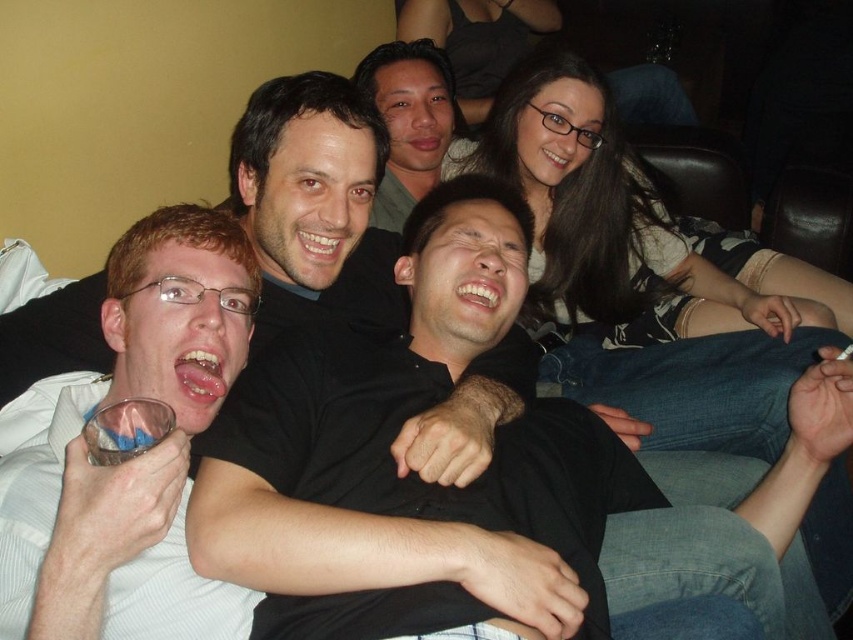
Can you confirm if black matte shirt at center is bigger than matte black shirt at upper center?

Indeed, black matte shirt at center has a larger size compared to matte black shirt at upper center.

Between point (355, 609) and point (358, 298), which one is positioned in front?

Point (355, 609)

At what (x,y) coordinates should I click in order to perform the action: click on black matte shirt at center. Please return your answer as a coordinate pair (x, y). Looking at the image, I should click on (408, 477).

Does black matte shirt at center lie behind white striped shirt at left?

Yes, it is behind white striped shirt at left.

From the picture: Does black matte shirt at center come in front of white striped shirt at left?

No.

Who is more distant from viewer, (x=483, y=220) or (x=183, y=225)?

Positioned behind is point (x=483, y=220).

Locate an element on the screen. black matte shirt at center is located at coordinates (408, 477).

Is the position of black matte shirt at center less distant than that of matte black shirt at center?

Yes, black matte shirt at center is in front of matte black shirt at center.

Is black matte shirt at center smaller than matte black shirt at center?

No.

Is point (328, 515) farther from camera compared to point (413, 163)?

No, (328, 515) is closer to viewer.

In order to click on black matte shirt at center in this screenshot , I will do `click(408, 477)`.